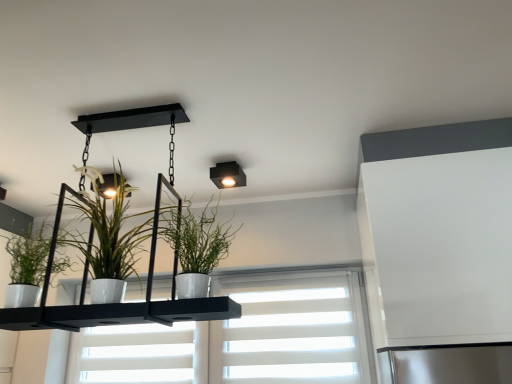
Question: From the image's perspective, is green matte plant at left, placed as the third houseplant when sorted from right to left, located above or below matte black square light fixture at upper center?

Choices:
 (A) above
 (B) below

Answer: (B)

Question: Relative to matte black square light fixture at upper center, is green matte plant at left, the first houseplant from the left, in front or behind?

Choices:
 (A) behind
 (B) front

Answer: (B)

Question: Which object is the farthest from the matte black square light fixture at upper center?

Choices:
 (A) white glossy pot at center, marked as the first houseplant in a right-to-left arrangement
 (B) green matte plant at left, the first houseplant from the left
 (C) white matte window at center
 (D) white glossy pot at center, which appears as the second houseplant when viewed from the right

Answer: (B)

Question: Estimate the real-world distances between objects in this image. Which object is farther from the white matte window at center?

Choices:
 (A) green matte plant at left, the first houseplant from the left
 (B) matte black square light fixture at upper center
 (C) white glossy pot at center, the 2th houseplant from the left
 (D) white glossy pot at center, which is the third houseplant in left-to-right order

Answer: (A)